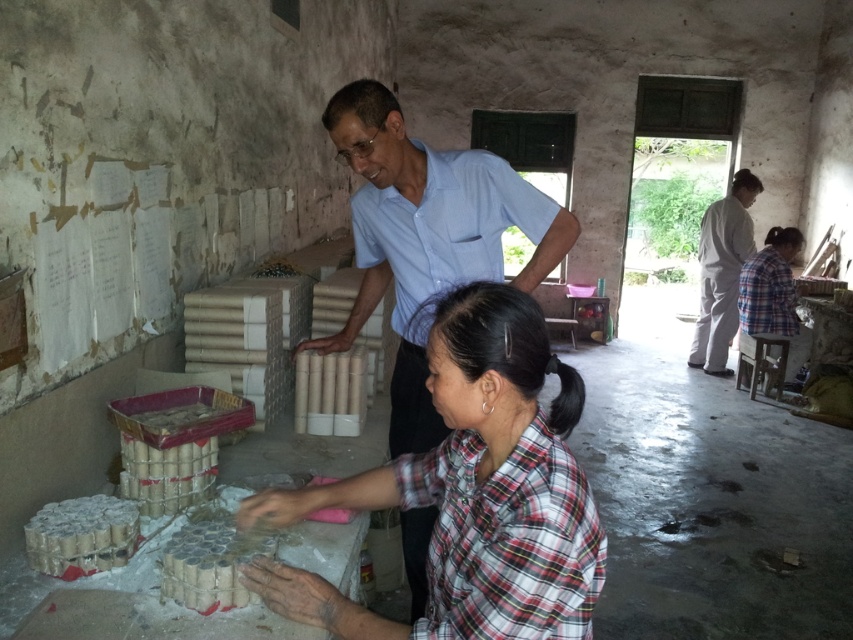
You are standing in the workshop scene. There is a point at coordinates (773, 296). What object is located at that point?

The point at coordinates (773, 296) corresponds to the plaid fabric shirt at lower right.

You are an observer looking at the scene in the workshop. You notice the light blue cotton shirt at upper center and the black silky hair at center. Which object appears bigger in the image?

The light blue cotton shirt at upper center appears bigger than the black silky hair at center because it has a larger size.